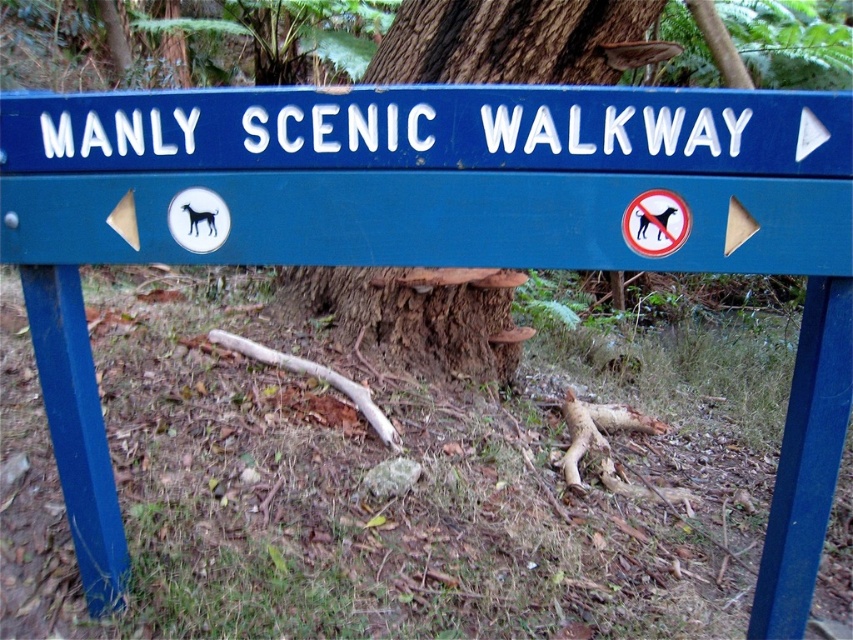
Question: Does blue painted metal sign at upper center have a lesser width compared to brown rough bark at center?

Choices:
 (A) no
 (B) yes

Answer: (A)

Question: Among these objects, which one is farthest from the camera?

Choices:
 (A) blue painted metal sign at upper center
 (B) brown rough bark at center
 (C) blue painted wood sign at center

Answer: (B)

Question: Which of the following is the farthest from the observer?

Choices:
 (A) (268, 128)
 (B) (451, 136)

Answer: (A)

Question: Where is blue painted wood sign at center located in relation to brown rough bark at center in the image?

Choices:
 (A) above
 (B) below

Answer: (A)

Question: Which point is farther to the camera?

Choices:
 (A) (457, 92)
 (B) (466, 298)

Answer: (B)

Question: Is blue painted wood sign at center thinner than blue painted metal sign at upper center?

Choices:
 (A) no
 (B) yes

Answer: (A)